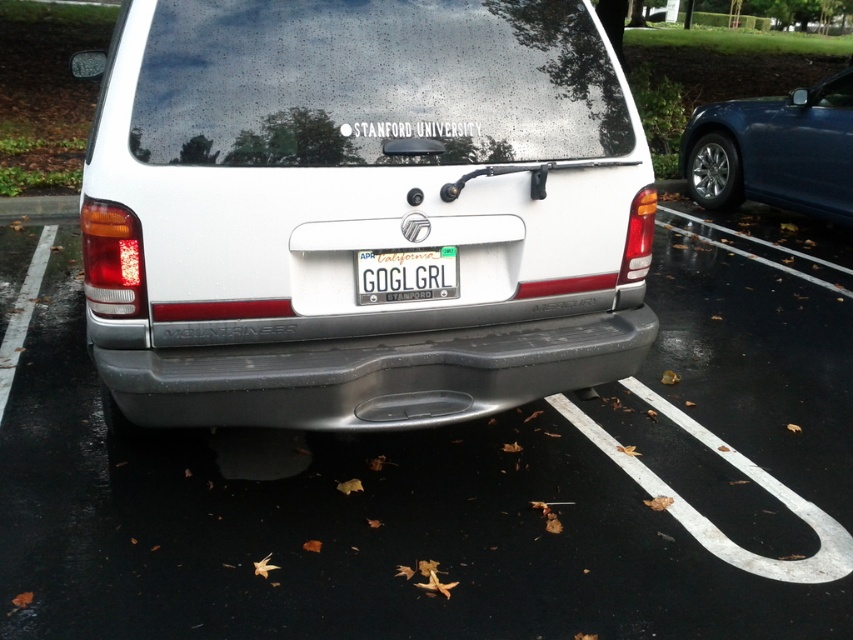
Question: Can you confirm if white matte van at center is positioned above gray matte bumper at center?

Choices:
 (A) no
 (B) yes

Answer: (B)

Question: Does white matte vehicle at center appear on the right side of white plastic license plate at center?

Choices:
 (A) yes
 (B) no

Answer: (A)

Question: Which point is closer to the camera taking this photo?

Choices:
 (A) (281, 572)
 (B) (363, 346)
 (C) (619, 337)

Answer: (A)

Question: Observing the image, what is the correct spatial positioning of white matte van at center in reference to glossy blue sedan at right?

Choices:
 (A) above
 (B) below

Answer: (B)

Question: Estimate the real-world distances between objects in this image. Which object is farther from the white plastic license plate at center?

Choices:
 (A) white matte vehicle at center
 (B) gray matte bumper at center
 (C) glossy blue sedan at right
 (D) white matte van at center

Answer: (C)

Question: Which point is closer to the camera?

Choices:
 (A) white plastic license plate at center
 (B) white matte van at center
 (C) white matte vehicle at center
 (D) glossy blue sedan at right

Answer: (C)